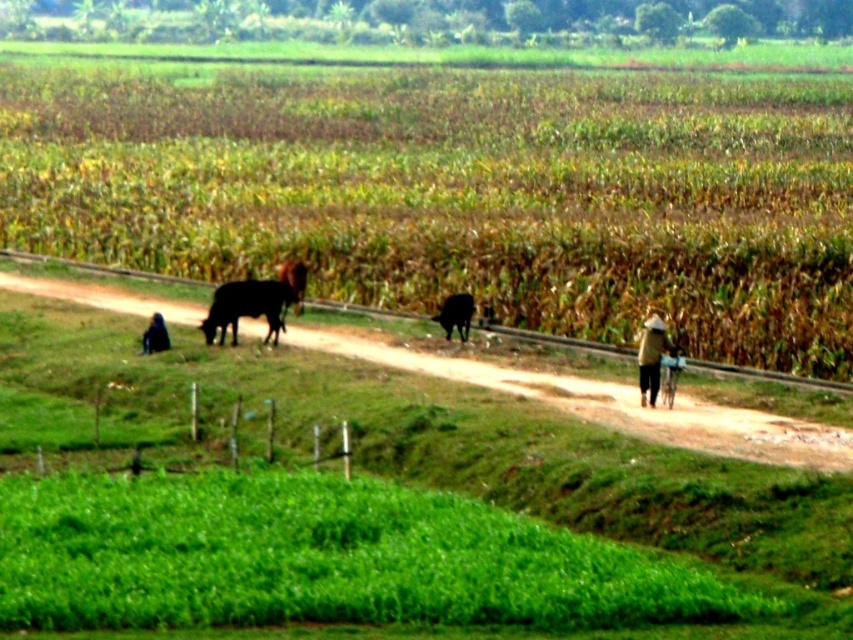
You are standing at the point with coordinates point (648, 332) and want to walk towards the point with coordinates point (688, 259). Which direction should you face to move towards it?

You should face towards the upper direction because point (688, 259) is further to the camera than point (648, 332), meaning it is closer to your current position.

You are standing at the wire fence in the foreground and looking towards the dirt path. Which cow, the black glossy cow at left or the black fur cow at center, is positioned closer to the fence?

The black glossy cow at left is closer to the fence because it is positioned to the right of the black fur cow at center, meaning it is nearer to the observer standing at the fence.